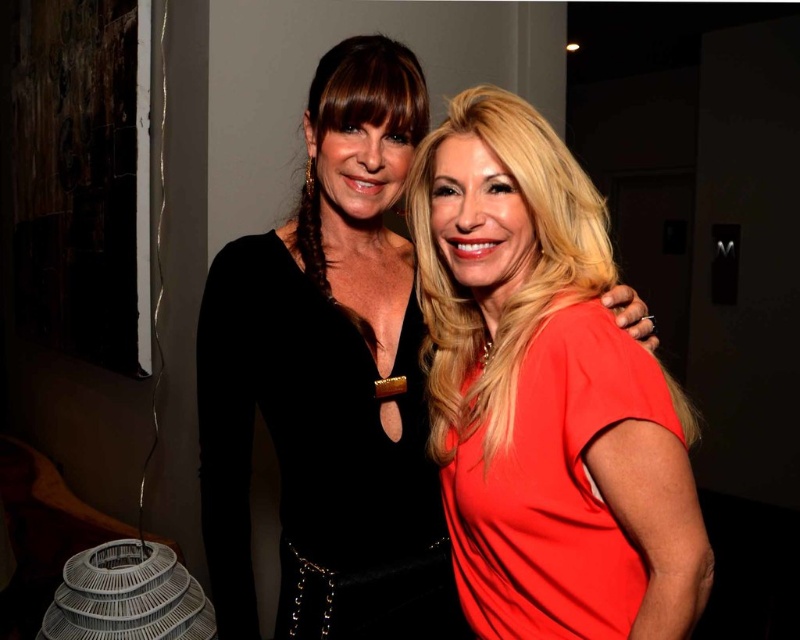
Between velvet black dress at center and matte red dress at right, which one is positioned higher?

Positioned higher is velvet black dress at center.

Does point (385, 580) come in front of point (498, 540)?

No, it is not.

The height and width of the screenshot is (640, 800). I want to click on velvet black dress at center, so click(x=316, y=460).

What do you see at coordinates (329, 381) in the screenshot? I see `matte black dress at center` at bounding box center [329, 381].

Between matte black dress at center and matte red dress at right, which one has less height?

Standing shorter between the two is matte red dress at right.

What do you see at coordinates (329, 381) in the screenshot? Image resolution: width=800 pixels, height=640 pixels. I see `matte black dress at center` at bounding box center [329, 381].

I want to click on matte black dress at center, so click(329, 381).

Does matte black dress at center come behind velvet black dress at center?

That is False.

Does matte black dress at center have a greater height compared to velvet black dress at center?

Correct, matte black dress at center is much taller as velvet black dress at center.

Is point (326, 360) more distant than point (232, 298)?

No, it is in front of (232, 298).

Locate an element on the screen. matte black dress at center is located at coordinates (329, 381).